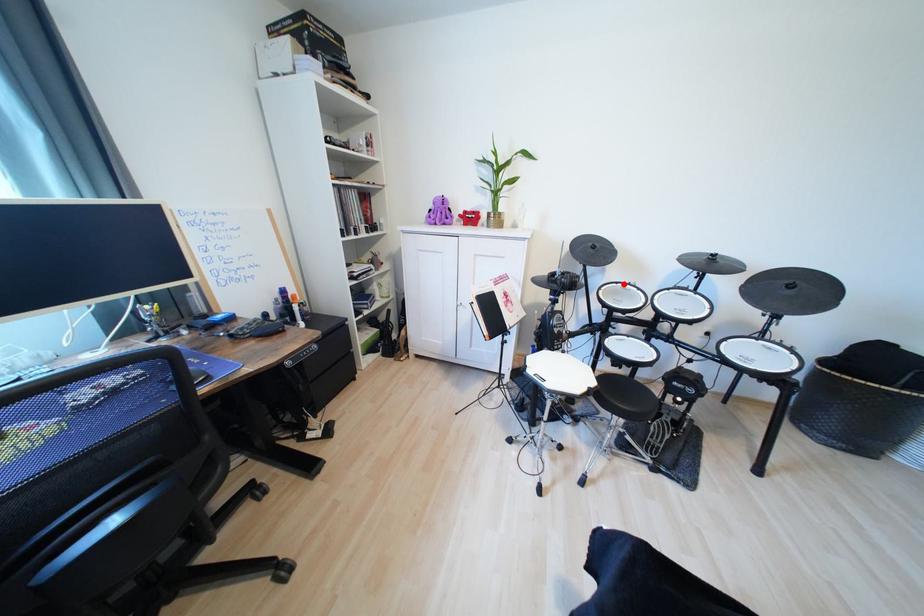
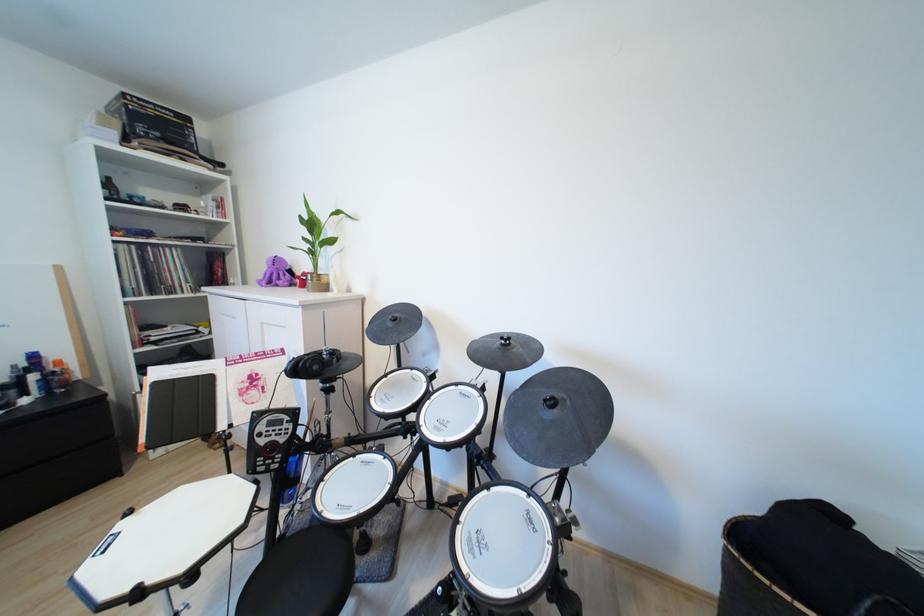
The point at the highlighted location is marked in the first image. Where is the corresponding point in the second image?

(419, 370)